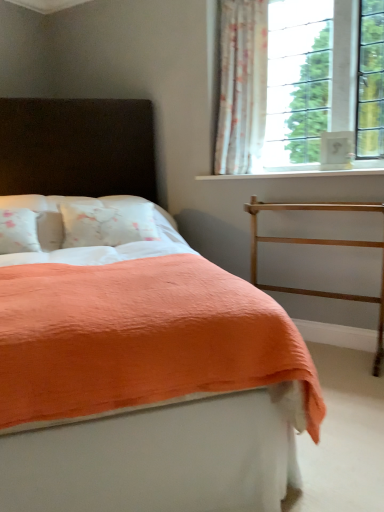
Question: Is gold metallic balustrade at right inside white smooth window sill at upper right?

Choices:
 (A) no
 (B) yes

Answer: (A)

Question: Does white smooth window sill at upper right appear on the right side of gold metallic balustrade at right?

Choices:
 (A) yes
 (B) no

Answer: (B)

Question: Is gold metallic balustrade at right at the back of white smooth window sill at upper right?

Choices:
 (A) no
 (B) yes

Answer: (A)

Question: Is white smooth window sill at upper right directly adjacent to gold metallic balustrade at right?

Choices:
 (A) no
 (B) yes

Answer: (A)

Question: Can you confirm if white smooth window sill at upper right is shorter than gold metallic balustrade at right?

Choices:
 (A) yes
 (B) no

Answer: (A)

Question: From a real-world perspective, is white smooth window sill at upper right beneath gold metallic balustrade at right?

Choices:
 (A) yes
 (B) no

Answer: (B)

Question: Could you tell me if coral fabric bed at center is facing white smooth window sill at upper right?

Choices:
 (A) no
 (B) yes

Answer: (A)

Question: Does coral fabric bed at center have a larger size compared to white smooth window sill at upper right?

Choices:
 (A) no
 (B) yes

Answer: (B)

Question: Does coral fabric bed at center have a smaller size compared to white smooth window sill at upper right?

Choices:
 (A) yes
 (B) no

Answer: (B)

Question: From the image's perspective, is coral fabric bed at center beneath white smooth window sill at upper right?

Choices:
 (A) yes
 (B) no

Answer: (A)

Question: Is coral fabric bed at center directly adjacent to white smooth window sill at upper right?

Choices:
 (A) no
 (B) yes

Answer: (A)

Question: Is coral fabric bed at center positioned beyond the bounds of white smooth window sill at upper right?

Choices:
 (A) yes
 (B) no

Answer: (A)

Question: Could you tell me if gold metallic balustrade at right is turned towards coral fabric bed at center?

Choices:
 (A) yes
 (B) no

Answer: (A)